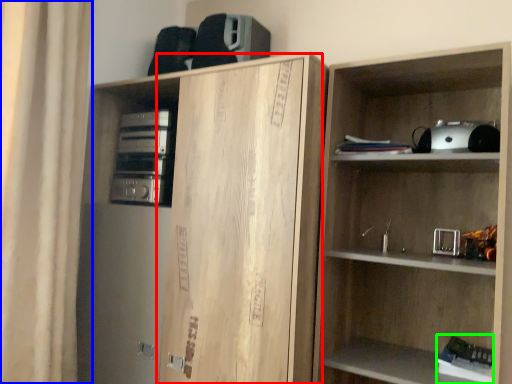
Question: Based on their relative distances, which object is nearer to cabinetry (highlighted by a red box)? Choose from curtain (highlighted by a blue box) and book (highlighted by a green box).

Choices:
 (A) curtain
 (B) book

Answer: (A)